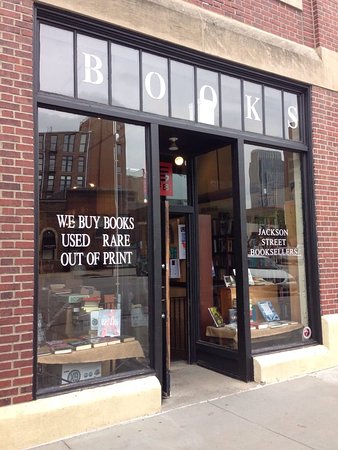
Identify the location of wall. (3, 246), (327, 162), (286, 26).